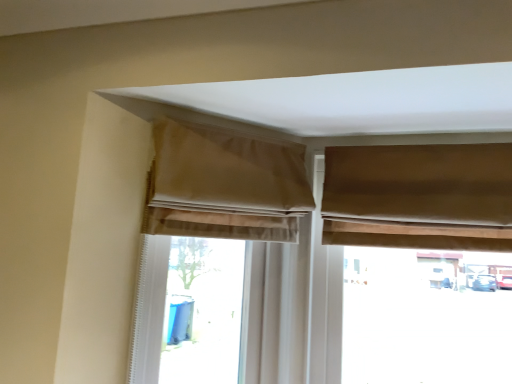
Image resolution: width=512 pixels, height=384 pixels. I want to click on beige fabric curtain at upper center, the second curtain in the left-to-right sequence, so click(225, 185).

Image resolution: width=512 pixels, height=384 pixels. In order to click on beige fabric window at upper center in this screenshot , I will do `click(245, 286)`.

Does beige fabric curtain at upper center, the second curtain in the left-to-right sequence, have a greater height compared to beige fabric curtain at upper left, the 1th curtain from the left?

Incorrect, the height of beige fabric curtain at upper center, the second curtain in the left-to-right sequence, is not larger of that of beige fabric curtain at upper left, the 1th curtain from the left.

From a real-world perspective, which object rests below the other?

In real-world perspective, beige fabric curtain at upper left, the 1th curtain from the left, is lower.

Based on their sizes in the image, would you say beige fabric curtain at upper center, the second curtain in the left-to-right sequence, is bigger or smaller than beige fabric curtain at upper left, the 1th curtain from the left?

beige fabric curtain at upper center, the second curtain in the left-to-right sequence, is smaller than beige fabric curtain at upper left, the 1th curtain from the left.

Consider the image. Is matte brown curtain at upper right, marked as the 3th curtain in a left-to-right arrangement, oriented away from beige fabric curtain at upper left, the third curtain when ordered from right to left?

No, matte brown curtain at upper right, marked as the 3th curtain in a left-to-right arrangement,'s orientation is not away from beige fabric curtain at upper left, the third curtain when ordered from right to left.

Would you say matte brown curtain at upper right, marked as the 3th curtain in a left-to-right arrangement, contains beige fabric curtain at upper left, the 1th curtain from the left?

No, matte brown curtain at upper right, marked as the 3th curtain in a left-to-right arrangement, does not contain beige fabric curtain at upper left, the 1th curtain from the left.

Is matte brown curtain at upper right, marked as the first curtain in a right-to-left arrangement, far from beige fabric curtain at upper left, the 1th curtain from the left?

No, there isn't a large distance between matte brown curtain at upper right, marked as the first curtain in a right-to-left arrangement, and beige fabric curtain at upper left, the 1th curtain from the left.

Which object is wider, matte brown curtain at upper right, marked as the 3th curtain in a left-to-right arrangement, or beige fabric curtain at upper left, the 1th curtain from the left?

beige fabric curtain at upper left, the 1th curtain from the left.

Considering the points (187, 148) and (361, 160), which point is behind, point (187, 148) or point (361, 160)?

Point (361, 160)

Which curtain is the 1st one when counting from the front of the matte brown curtain at upper right, marked as the first curtain in a right-to-left arrangement? Please provide its 2D coordinates.

[(224, 185)]

Is the surface of beige fabric curtain at upper left, the 1th curtain from the left, in direct contact with matte brown curtain at upper right, marked as the first curtain in a right-to-left arrangement?

No.

From the image's perspective, who appears lower, beige fabric curtain at upper left, the 1th curtain from the left, or matte brown curtain at upper right, marked as the 3th curtain in a left-to-right arrangement?

beige fabric curtain at upper left, the 1th curtain from the left, from the image's perspective.

Is beige fabric curtain at upper left, the third curtain when ordered from right to left, at the left side of beige fabric window at upper center?

Correct, you'll find beige fabric curtain at upper left, the third curtain when ordered from right to left, to the left of beige fabric window at upper center.

From a real-world perspective, which object stands above the other?

beige fabric window at upper center, from a real-world perspective.

Is beige fabric curtain at upper left, the third curtain when ordered from right to left, taller or shorter than beige fabric window at upper center?

beige fabric curtain at upper left, the third curtain when ordered from right to left, is shorter than beige fabric window at upper center.

Does beige fabric curtain at upper left, the 1th curtain from the left, come in front of beige fabric window at upper center?

Yes, it is in front of beige fabric window at upper center.

Considering the relative sizes of beige fabric window at upper center and matte brown curtain at upper right, marked as the first curtain in a right-to-left arrangement, in the image provided, is beige fabric window at upper center taller than matte brown curtain at upper right, marked as the first curtain in a right-to-left arrangement,?

Yes.

From a real-world perspective, count 2nd curtains upward from the beige fabric window at upper center and point to it. Please provide its 2D coordinates.

[(419, 196)]

Is beige fabric window at upper center wider than matte brown curtain at upper right, marked as the 3th curtain in a left-to-right arrangement?

Yes.

Is beige fabric window at upper center next to matte brown curtain at upper right, marked as the 3th curtain in a left-to-right arrangement?

No, beige fabric window at upper center is not with matte brown curtain at upper right, marked as the 3th curtain in a left-to-right arrangement.

Are matte brown curtain at upper right, marked as the first curtain in a right-to-left arrangement, and beige fabric window at upper center making contact?

No, matte brown curtain at upper right, marked as the first curtain in a right-to-left arrangement, is not with beige fabric window at upper center.

Is matte brown curtain at upper right, marked as the 3th curtain in a left-to-right arrangement, at the right side of beige fabric window at upper center?

No, matte brown curtain at upper right, marked as the 3th curtain in a left-to-right arrangement, is not to the right of beige fabric window at upper center.

From the image's perspective, would you say matte brown curtain at upper right, marked as the first curtain in a right-to-left arrangement, is shown under beige fabric window at upper center?

No, from the image's perspective, matte brown curtain at upper right, marked as the first curtain in a right-to-left arrangement, is not beneath beige fabric window at upper center.

Relative to beige fabric window at upper center, is matte brown curtain at upper right, marked as the first curtain in a right-to-left arrangement, in front or behind?

matte brown curtain at upper right, marked as the first curtain in a right-to-left arrangement, is in front of beige fabric window at upper center.

Between beige fabric curtain at upper left, the 1th curtain from the left, and beige fabric curtain at upper center, the second curtain in the left-to-right sequence, which one has smaller width?

beige fabric curtain at upper center, the second curtain in the left-to-right sequence.

This screenshot has width=512, height=384. In order to click on curtain on the left of the beige fabric curtain at upper center, the second curtain in the left-to-right sequence in this screenshot , I will do `click(224, 185)`.

Is beige fabric curtain at upper left, the 1th curtain from the left, oriented away from beige fabric curtain at upper center, the second curtain in the left-to-right sequence?

Yes, beige fabric curtain at upper left, the 1th curtain from the left, is positioned with its back facing beige fabric curtain at upper center, the second curtain in the left-to-right sequence.

Does beige fabric curtain at upper left, the third curtain when ordered from right to left, have a larger size compared to beige fabric curtain at upper center, which is the 2th curtain from right to left?

Yes, beige fabric curtain at upper left, the third curtain when ordered from right to left, is bigger than beige fabric curtain at upper center, which is the 2th curtain from right to left.

There is a beige fabric curtain at upper left, the 1th curtain from the left. Where is `the 2nd curtain above it (from the image's perspective)`? The height and width of the screenshot is (384, 512). the 2nd curtain above it (from the image's perspective) is located at coordinates (225, 185).

Where is `curtain that is the 1st object located in front of the matte brown curtain at upper right, marked as the 3th curtain in a left-to-right arrangement`? curtain that is the 1st object located in front of the matte brown curtain at upper right, marked as the 3th curtain in a left-to-right arrangement is located at coordinates (224, 185).

Estimate the real-world distances between objects in this image. Which object is further from matte brown curtain at upper right, marked as the first curtain in a right-to-left arrangement, beige fabric window at upper center or beige fabric curtain at upper left, the third curtain when ordered from right to left?

beige fabric curtain at upper left, the third curtain when ordered from right to left.

When comparing their distances from beige fabric window at upper center, does beige fabric curtain at upper center, which is the 2th curtain from right to left, or matte brown curtain at upper right, marked as the 3th curtain in a left-to-right arrangement, seem closer?

beige fabric curtain at upper center, which is the 2th curtain from right to left, lies closer to beige fabric window at upper center than the other object.

Which object lies nearer to the anchor point beige fabric window at upper center, beige fabric curtain at upper left, the 1th curtain from the left, or matte brown curtain at upper right, marked as the first curtain in a right-to-left arrangement?

The object closer to beige fabric window at upper center is beige fabric curtain at upper left, the 1th curtain from the left.

From the image, which object appears to be nearer to beige fabric curtain at upper left, the third curtain when ordered from right to left, matte brown curtain at upper right, marked as the first curtain in a right-to-left arrangement, or beige fabric curtain at upper center, the second curtain in the left-to-right sequence?

Among the two, beige fabric curtain at upper center, the second curtain in the left-to-right sequence, is located nearer to beige fabric curtain at upper left, the third curtain when ordered from right to left.

Considering their positions, is beige fabric curtain at upper left, the third curtain when ordered from right to left, positioned further to beige fabric curtain at upper center, the second curtain in the left-to-right sequence, than beige fabric window at upper center?

Among the two, beige fabric window at upper center is located further to beige fabric curtain at upper center, the second curtain in the left-to-right sequence.

Looking at the image, which one is located further to beige fabric window at upper center, beige fabric curtain at upper left, the third curtain when ordered from right to left, or beige fabric curtain at upper center, which is the 2th curtain from right to left?

beige fabric curtain at upper center, which is the 2th curtain from right to left, is positioned further to the anchor beige fabric window at upper center.

From the image, which object appears to be farther from beige fabric window at upper center, matte brown curtain at upper right, marked as the first curtain in a right-to-left arrangement, or beige fabric curtain at upper center, which is the 2th curtain from right to left?

Based on the image, matte brown curtain at upper right, marked as the first curtain in a right-to-left arrangement, appears to be further to beige fabric window at upper center.

When comparing their distances from beige fabric curtain at upper center, the second curtain in the left-to-right sequence, does matte brown curtain at upper right, marked as the first curtain in a right-to-left arrangement, or beige fabric window at upper center seem further?

matte brown curtain at upper right, marked as the first curtain in a right-to-left arrangement, is further to beige fabric curtain at upper center, the second curtain in the left-to-right sequence.

I want to click on curtain between beige fabric curtain at upper center, which is the 2th curtain from right to left, and beige fabric window at upper center from left to right, so click(419, 196).

The image size is (512, 384). What are the coordinates of `curtain situated between beige fabric curtain at upper left, the 1th curtain from the left, and matte brown curtain at upper right, marked as the first curtain in a right-to-left arrangement, from left to right` in the screenshot? It's located at (x=225, y=185).